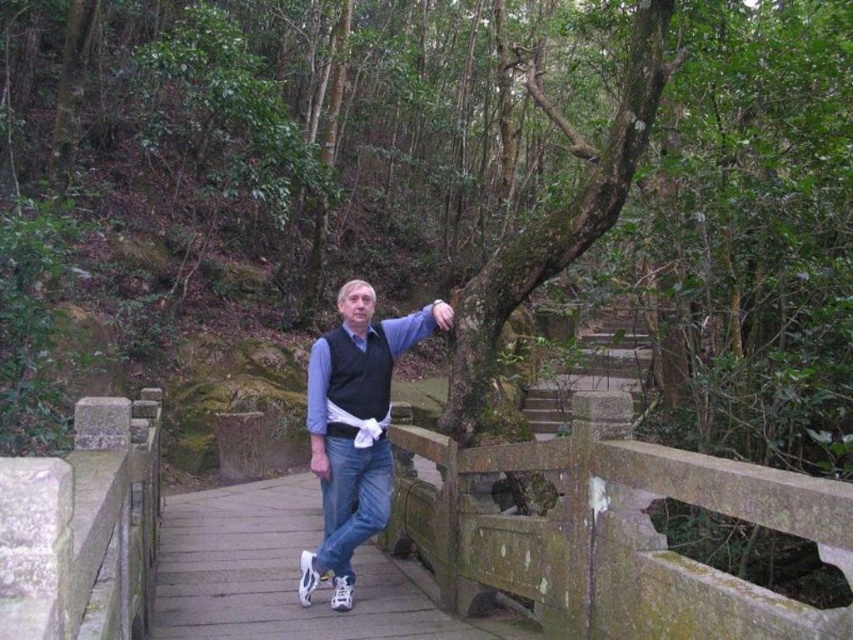
You are a hiker who needs to cross the wooden bridge. You notice the green mossy stone rail at lower center. Based on its location, can you estimate where it is positioned relative to the bridge?

The green mossy stone rail at lower center is located at point (611, 531), which places it near the lower part of the bridge, likely on the side closest to the hiker.

Looking at this image, you are a hiker who wants to cross the wooden bridge safely. Your blue denim jeans at center are currently touching the green mossy stone rail at lower center. Is there enough space between them to move your legs freely while walking?

The distance between the green mossy stone rail at lower center and blue denim jeans at center is 3.76 feet, which is sufficient for a hiker to move their legs freely while walking.

In the scene shown: You are a photographer trying to capture the man in the image. You want to ensure both the white leather sneakers at center and the blue denim jeans at center are clearly visible in the frame. Given their widths, which object should you focus on to ensure both are in focus?

The white leather sneakers at center are wider than the blue denim jeans at center. To ensure both are in focus, you should focus on the white leather sneakers at center since their greater width allows for a larger area of sharpness coverage.